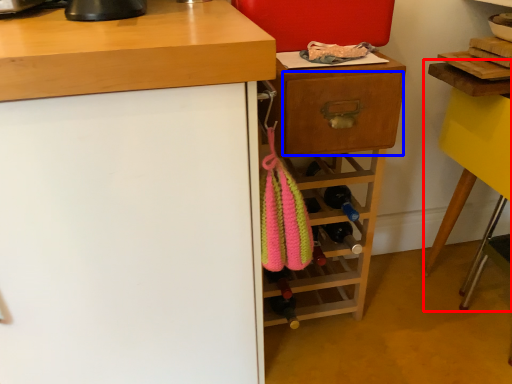
Question: Which object is closer to the camera taking this photo, computer desk (highlighted by a red box) or drawer (highlighted by a blue box)?

Choices:
 (A) computer desk
 (B) drawer

Answer: (A)